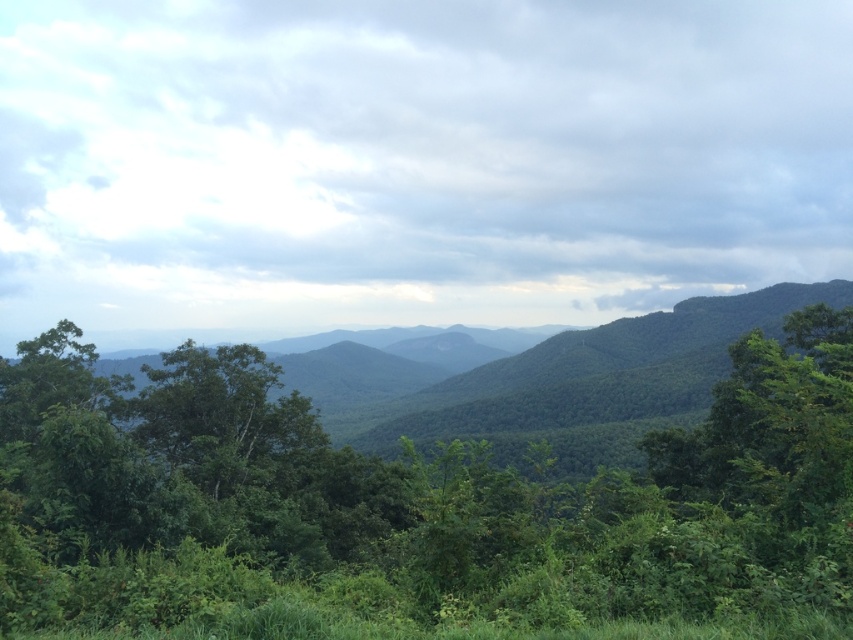
Question: Where is green leafy forest at center located in relation to green leafy tree at center in the image?

Choices:
 (A) below
 (B) above

Answer: (A)

Question: Which point is closer to the camera?

Choices:
 (A) green leafy tree at center
 (B) green leafy forest at center

Answer: (B)

Question: Which object appears closest to the camera in this image?

Choices:
 (A) green leafy tree at center
 (B) green leafy forest at center

Answer: (B)

Question: Where is green leafy forest at center located in relation to green leafy tree at center in the image?

Choices:
 (A) right
 (B) left

Answer: (A)

Question: Among these objects, which one is nearest to the camera?

Choices:
 (A) green leafy forest at center
 (B) green leafy tree at center

Answer: (A)

Question: Can you confirm if green leafy forest at center is positioned to the left of green leafy tree at center?

Choices:
 (A) yes
 (B) no

Answer: (B)